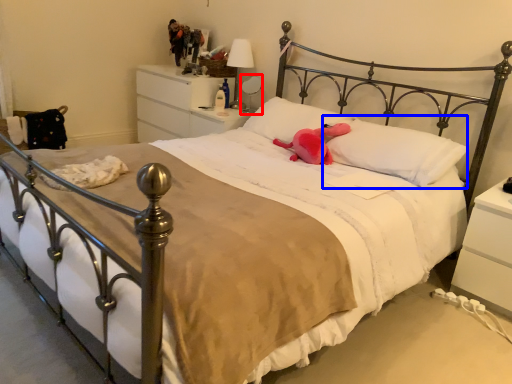
Question: Which object appears closest to the camera in this image, table lamp (highlighted by a red box) or pillow (highlighted by a blue box)?

Choices:
 (A) table lamp
 (B) pillow

Answer: (B)